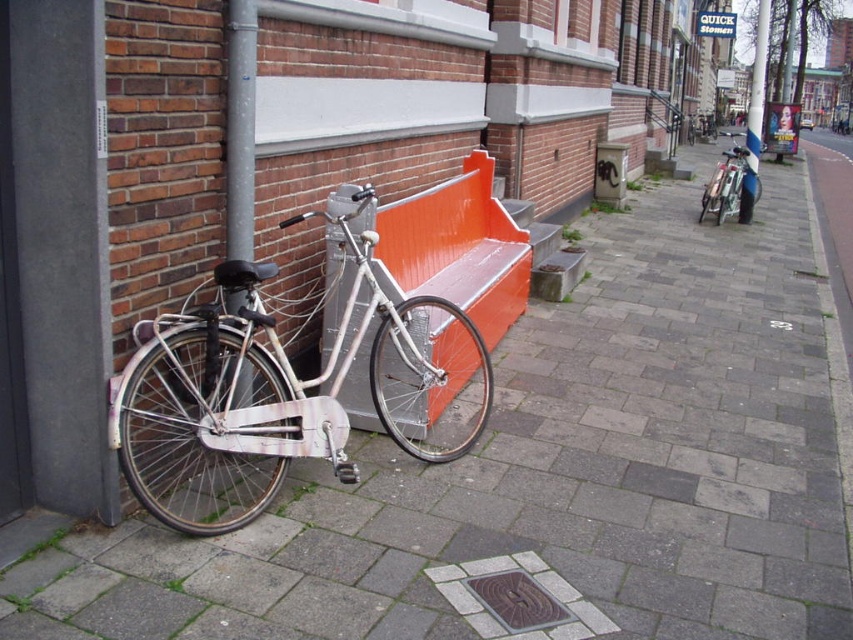
Which is above, gray metallic pole at left or shiny silver bicycle at right?

shiny silver bicycle at right is higher up.

Which is below, gray metallic pole at left or shiny silver bicycle at right?

Positioned lower is gray metallic pole at left.

Is point (242, 49) positioned in front of point (718, 193)?

That is True.

The width and height of the screenshot is (853, 640). I want to click on gray metallic pole at left, so click(x=241, y=128).

Between silver metallic bicycle at left and shiny silver bicycle at right, which one appears on the right side from the viewer's perspective?

From the viewer's perspective, shiny silver bicycle at right appears more on the right side.

What do you see at coordinates (277, 381) in the screenshot? I see `silver metallic bicycle at left` at bounding box center [277, 381].

At what (x,y) coordinates should I click in order to perform the action: click on silver metallic bicycle at left. Please return your answer as a coordinate pair (x, y). The height and width of the screenshot is (640, 853). Looking at the image, I should click on (277, 381).

Can you confirm if silver metallic bicycle at left is positioned to the left of gray metallic pole at left?

In fact, silver metallic bicycle at left is to the right of gray metallic pole at left.

Describe the element at coordinates (277, 381) in the screenshot. I see `silver metallic bicycle at left` at that location.

Who is more distant from viewer, [270,454] or [248,161]?

Point [248,161]

What are the coordinates of `silver metallic bicycle at left` in the screenshot? It's located at (277, 381).